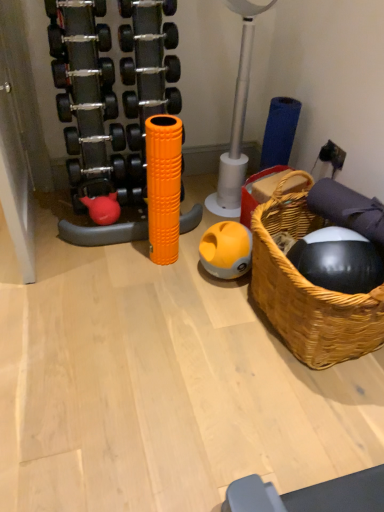
What are the coordinates of `vacant area that is situated to the right of orange foam roller at center` in the screenshot? It's located at (193, 257).